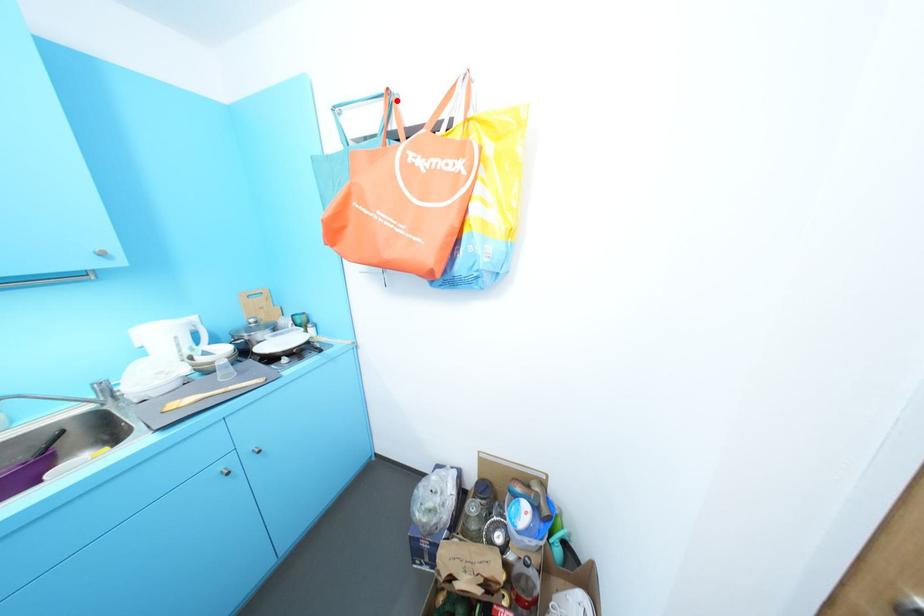
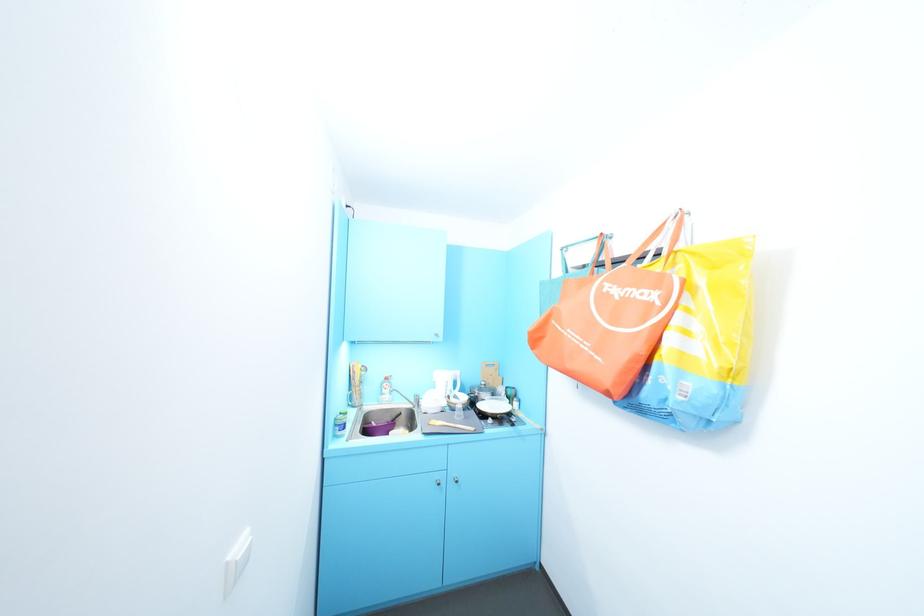
Question: I am providing you with two images of the same scene from different viewpoints. A red point is marked on the first image. Can you still see the location of the red point in image 2?

Choices:
 (A) Yes
 (B) No

Answer: (A)